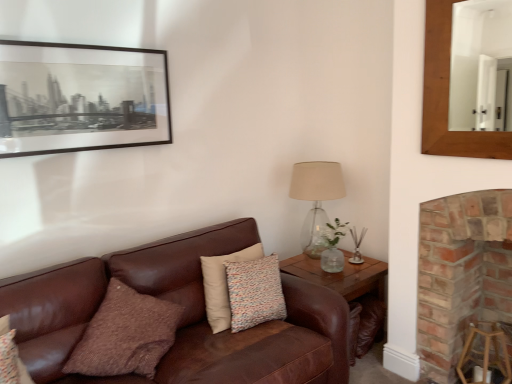
At what (x,y) coordinates should I click in order to perform the action: click on vacant area on top of black matte picture frame at upper left (from a real-world perspective). Please return your answer as a coordinate pair (x, y). Looking at the image, I should click on (75, 46).